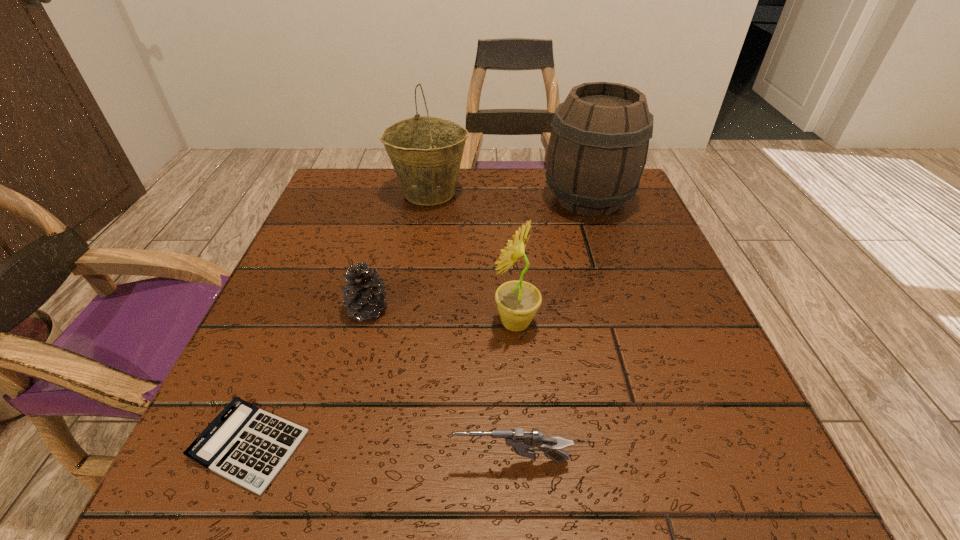
At what (x,y) coordinates should I click in order to perform the action: click on the left wine bucket. Please return your answer as a coordinate pair (x, y). The height and width of the screenshot is (540, 960). Looking at the image, I should click on (426, 151).

The height and width of the screenshot is (540, 960). Identify the location of the right wine bucket. (597, 151).

You are a GUI agent. You are given a task and a screenshot of the screen. Output one action in this format:
    pyautogui.click(x=<x>, y=<y>)
    Task: Click on the sunflower
    
    Given the screenshot: What is the action you would take?
    pyautogui.click(x=517, y=301)

Identify the location of the fourth tallest object. The image size is (960, 540). (364, 293).

This screenshot has height=540, width=960. What are the coordinates of `the fifth tallest object` in the screenshot? It's located at (522, 442).

Where is `the shortest object`? This screenshot has width=960, height=540. the shortest object is located at coordinates (248, 446).

Locate an element on the screen. free space located on the front of the left wine bucket is located at coordinates (420, 248).

Locate an element on the screen. The width and height of the screenshot is (960, 540). vacant space located 0.370m on the front of the rightmost object is located at coordinates (643, 361).

Where is `free point located on the face of the third tallest object`? This screenshot has width=960, height=540. free point located on the face of the third tallest object is located at coordinates point(464,323).

At what (x,y) coordinates should I click in order to perform the action: click on free space located on the face of the third tallest object. Please return your answer as a coordinate pair (x, y). Looking at the image, I should click on tap(301, 323).